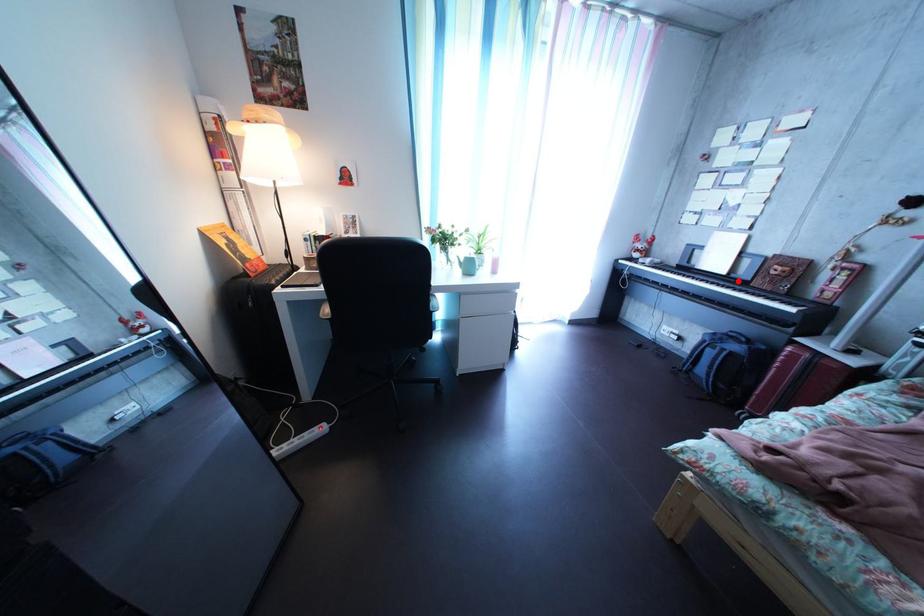
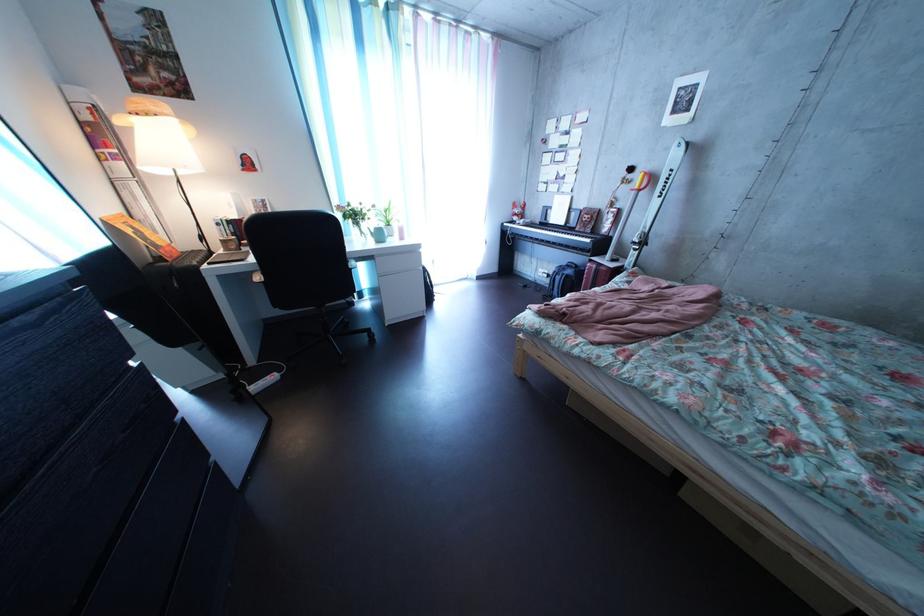
The point at the highlighted location is marked in the first image. Where is the corresponding point in the second image?

(577, 232)